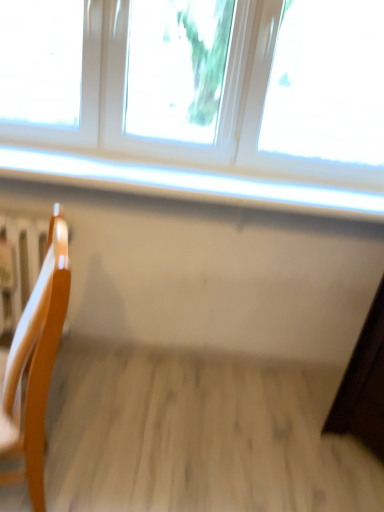
You are a GUI agent. You are given a task and a screenshot of the screen. Output one action in this format:
    pyautogui.click(x=<x>, y=<y>)
    Task: Click on the light wood chair at left
    Image resolution: width=384 pixels, height=512 pixels.
    Given the screenshot: What is the action you would take?
    pyautogui.click(x=36, y=362)

Locate an element on the screen. The width and height of the screenshot is (384, 512). light wood chair at left is located at coordinates (36, 362).

Considering the positions of objects white glossy window sill at upper center and light wood chair at left in the image provided, who is more to the right, white glossy window sill at upper center or light wood chair at left?

From the viewer's perspective, white glossy window sill at upper center appears more on the right side.

How many degrees apart are the facing directions of white glossy window sill at upper center and light wood chair at left?

They differ by 71.4 degrees in their facing directions.

Is white glossy window sill at upper center wider than light wood chair at left?

Correct, the width of white glossy window sill at upper center exceeds that of light wood chair at left.

Who is bigger, white plastic window at upper center or wooden radiator at left?

white plastic window at upper center is bigger.

Locate an element on the screen. Image resolution: width=384 pixels, height=512 pixels. window lying on the right of wooden radiator at left is located at coordinates (202, 83).

Between white plastic window at upper center and wooden radiator at left, which one is positioned in front?

Positioned in front is white plastic window at upper center.

Is white glossy window sill at upper center bigger than wooden radiator at left?

Incorrect, white glossy window sill at upper center is not larger than wooden radiator at left.

This screenshot has height=512, width=384. Find the location of `window sill that appears in front of the wooden radiator at left`. window sill that appears in front of the wooden radiator at left is located at coordinates (189, 183).

Which of these two, white glossy window sill at upper center or wooden radiator at left, is thinner?

wooden radiator at left.

Is white glossy window sill at upper center turned away from wooden radiator at left?

white glossy window sill at upper center does not have its back to wooden radiator at left.

From a real-world perspective, which is physically above, light wood chair at left or white glossy window sill at upper center?

In real-world perspective, white glossy window sill at upper center is above.

Which is more to the left, light wood chair at left or white glossy window sill at upper center?

Positioned to the left is light wood chair at left.

Does light wood chair at left have a greater width compared to white glossy window sill at upper center?

A: Incorrect, the width of light wood chair at left does not surpass that of white glossy window sill at upper center.

Consider the image. From the image's perspective, which is below, light wood chair at left or white glossy window sill at upper center?

light wood chair at left, from the image's perspective.

From the image's perspective, is wooden radiator at left on light wood chair at left?

Yes, from the image's perspective, wooden radiator at left is on top of light wood chair at left.

How distant is wooden radiator at left from light wood chair at left?

27.41 inches.

Is point (21, 302) positioned before point (13, 358)?

No.

Is wooden radiator at left with light wood chair at left?

No, wooden radiator at left is not in contact with light wood chair at left.

Would you say wooden radiator at left is a long distance from white glossy window sill at upper center?

No, wooden radiator at left is in close proximity to white glossy window sill at upper center.

Measure the distance between wooden radiator at left and white glossy window sill at upper center.

They are 22.78 inches apart.

Which is more to the right, wooden radiator at left or white glossy window sill at upper center?

From the viewer's perspective, white glossy window sill at upper center appears more on the right side.

What's the angular difference between wooden radiator at left and white glossy window sill at upper center's facing directions?

0.866 degrees.

Choose the correct answer: Is white plastic window at upper center inside white glossy window sill at upper center or outside it?

white plastic window at upper center cannot be found inside white glossy window sill at upper center.

Is white plastic window at upper center positioned far away from white glossy window sill at upper center?

That's not correct — white plastic window at upper center is a little close to white glossy window sill at upper center.

Does point (141, 102) come farther from viewer compared to point (46, 178)?

Yes, point (141, 102) is farther from viewer.

From the image's perspective, does white plastic window at upper center appear higher than white glossy window sill at upper center?

Yes.

The height and width of the screenshot is (512, 384). In the image, there is a light wood chair at left. In order to click on window sill above it (from the image's perspective) in this screenshot , I will do `click(189, 183)`.

Image resolution: width=384 pixels, height=512 pixels. Identify the location of radiator located below the white plastic window at upper center (from the image's perspective). tap(24, 268).

Based on their spatial positions, is white glossy window sill at upper center or light wood chair at left closer to white plastic window at upper center?

white glossy window sill at upper center.

Based on their spatial positions, is white glossy window sill at upper center or light wood chair at left further from wooden radiator at left?

light wood chair at left lies further to wooden radiator at left than the other object.

When comparing their distances from wooden radiator at left, does white plastic window at upper center or white glossy window sill at upper center seem closer?

white glossy window sill at upper center.

Estimate the real-world distances between objects in this image. Which object is further from wooden radiator at left, white glossy window sill at upper center or white plastic window at upper center?

The object further to wooden radiator at left is white plastic window at upper center.

When comparing their distances from white glossy window sill at upper center, does white plastic window at upper center or light wood chair at left seem further?

light wood chair at left is positioned further to the anchor white glossy window sill at upper center.

Looking at the image, which one is located further to light wood chair at left, white plastic window at upper center or wooden radiator at left?

white plastic window at upper center is positioned further to the anchor light wood chair at left.

From the image, which object appears to be nearer to white glossy window sill at upper center, wooden radiator at left or white plastic window at upper center?

white plastic window at upper center.

When comparing their distances from wooden radiator at left, does light wood chair at left or white glossy window sill at upper center seem closer?

white glossy window sill at upper center lies closer to wooden radiator at left than the other object.

Identify the location of window sill positioned between light wood chair at left and wooden radiator at left from near to far. (x=189, y=183).

Where is `window sill between white plastic window at upper center and light wood chair at left from top to bottom`? The width and height of the screenshot is (384, 512). window sill between white plastic window at upper center and light wood chair at left from top to bottom is located at coordinates (189, 183).

Identify the location of window sill located between wooden radiator at left and white plastic window at upper center in the left-right direction. The height and width of the screenshot is (512, 384). (189, 183).

Image resolution: width=384 pixels, height=512 pixels. I want to click on radiator between white plastic window at upper center and light wood chair at left in the up-down direction, so click(x=24, y=268).